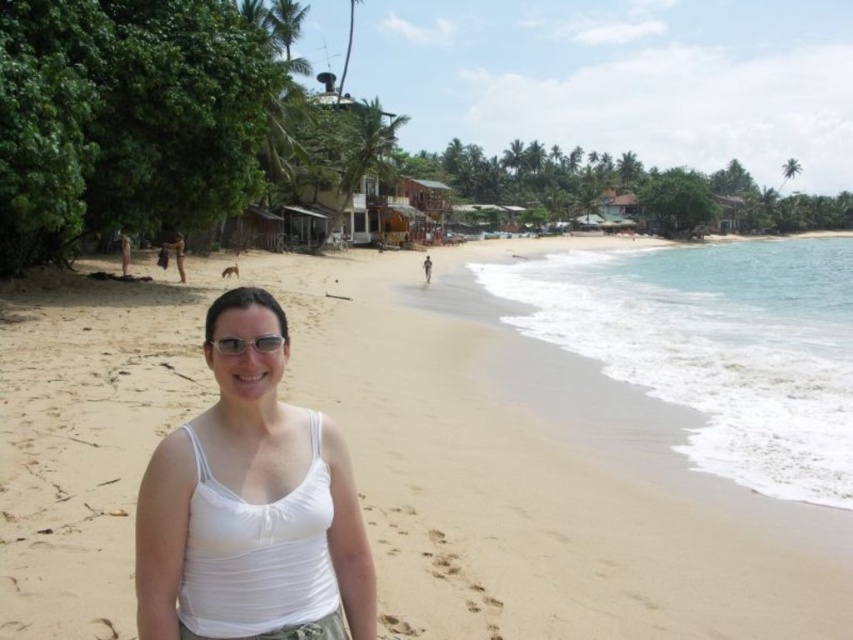
Question: Among these points, which one is nearest to the camera?

Choices:
 (A) pos(271,344)
 (B) pos(474,410)

Answer: (A)

Question: Observing the image, what is the correct spatial positioning of light beige sand at center in reference to white fabric at center?

Choices:
 (A) below
 (B) above

Answer: (B)

Question: Which point is closer to the camera?

Choices:
 (A) clear plastic glasses at center
 (B) light beige sand at center

Answer: (A)

Question: Does light beige sand at center appear on the right side of white fabric at center?

Choices:
 (A) yes
 (B) no

Answer: (B)

Question: Among these points, which one is nearest to the camera?

Choices:
 (A) (490, 563)
 (B) (277, 337)

Answer: (B)

Question: Can you confirm if white fabric at center is positioned to the right of clear plastic glasses at center?

Choices:
 (A) no
 (B) yes

Answer: (B)